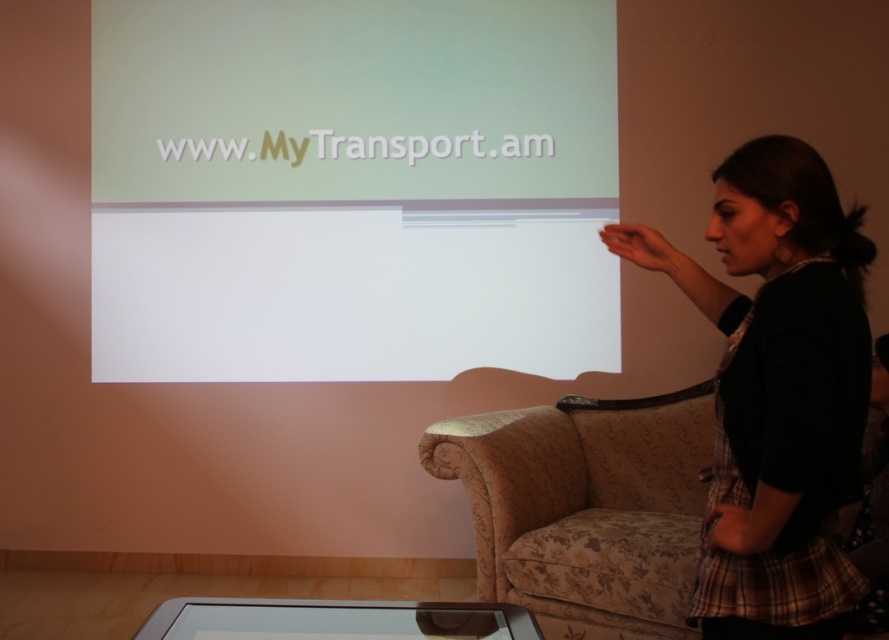
Who is higher up, white glossy projection screen at upper center or patterned fabric couch at lower right?

Positioned higher is white glossy projection screen at upper center.

Does white glossy projection screen at upper center have a greater height compared to patterned fabric couch at lower right?

Indeed, white glossy projection screen at upper center has a greater height compared to patterned fabric couch at lower right.

You are a GUI agent. You are given a task and a screenshot of the screen. Output one action in this format:
    pyautogui.click(x=<x>, y=<y>)
    Task: Click on the white glossy projection screen at upper center
    This screenshot has width=889, height=640.
    Given the screenshot: What is the action you would take?
    pyautogui.click(x=351, y=188)

Does black fabric at right come behind patterned fabric couch at lower right?

No, it is in front of patterned fabric couch at lower right.

Image resolution: width=889 pixels, height=640 pixels. Describe the element at coordinates (777, 392) in the screenshot. I see `black fabric at right` at that location.

What are the coordinates of `black fabric at right` in the screenshot? It's located at (777, 392).

Can you confirm if white glossy projection screen at upper center is bigger than black fabric at right?

Yes.

Is white glossy projection screen at upper center smaller than black fabric at right?

No, white glossy projection screen at upper center is not smaller than black fabric at right.

This screenshot has width=889, height=640. What do you see at coordinates (351, 188) in the screenshot?
I see `white glossy projection screen at upper center` at bounding box center [351, 188].

At what (x,y) coordinates should I click in order to perform the action: click on white glossy projection screen at upper center. Please return your answer as a coordinate pair (x, y). Looking at the image, I should click on (351, 188).